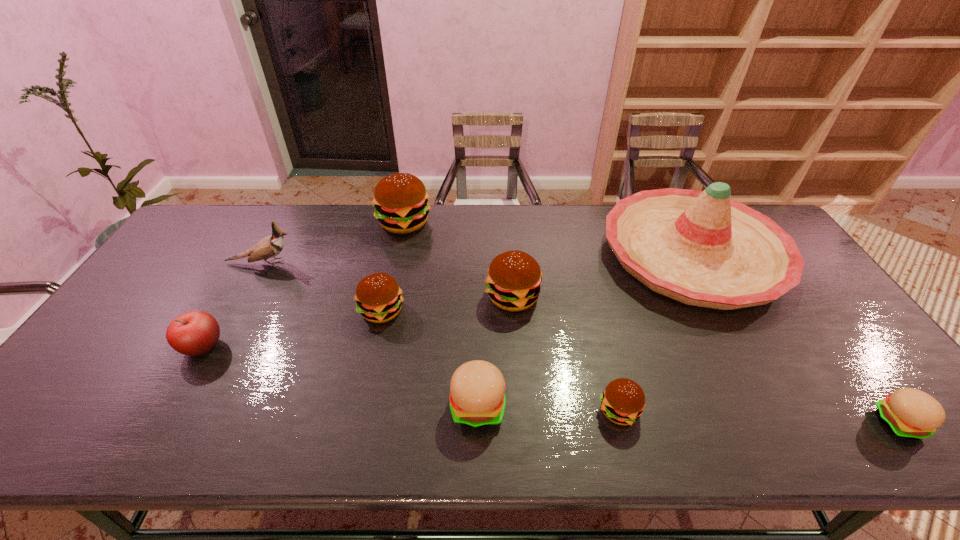
At what (x,y) coordinates should I click in order to perform the action: click on red sombrero. Please return your answer as a coordinate pair (x, y). The image size is (960, 540). Looking at the image, I should click on (701, 248).

You are a GUI agent. You are given a task and a screenshot of the screen. Output one action in this format:
    pyautogui.click(x=<x>, y=<y>)
    Task: Click on the sombrero
    Image resolution: width=960 pixels, height=540 pixels.
    Given the screenshot: What is the action you would take?
    coord(701,248)

Find the location of a particular element. Image resolution: width=960 pixels, height=540 pixels. the biggest brown hamburger is located at coordinates (400, 200).

I want to click on the farthest brown hamburger, so click(x=400, y=200).

This screenshot has width=960, height=540. I want to click on bird, so click(268, 247).

In order to click on the second brown hamburger from right to left in this screenshot , I will do `click(513, 283)`.

Where is `the second tallest hamburger`? The image size is (960, 540). the second tallest hamburger is located at coordinates pyautogui.click(x=513, y=283).

I want to click on the second smallest brown hamburger, so 378,296.

At what (x,y) coordinates should I click in order to perform the action: click on red apple. Please return your answer as a coordinate pair (x, y). Looking at the image, I should click on (193, 333).

Identify the location of apple. Image resolution: width=960 pixels, height=540 pixels. (193, 333).